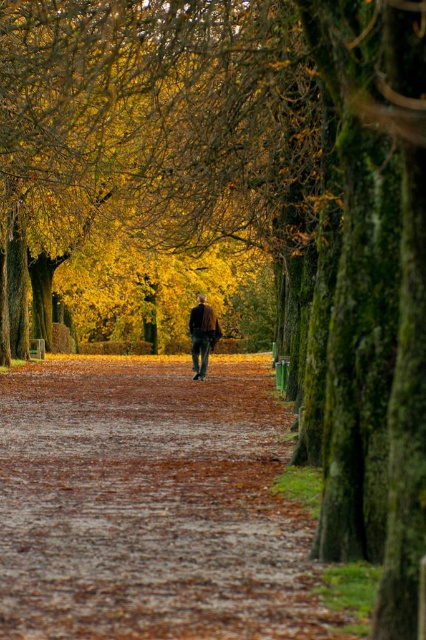
You are standing in the autumn park and see the brown leafy path at center and the dark brown leather jacket at center. Which object is located more to the left?

The brown leafy path at center is positioned on the left side of dark brown leather jacket at center, so it is more to the left.

You are standing at the starting point of the pathway in the autumn park scene. There are two points marked on the path ahead of you. The first point is at coordinates point (275, 422) and the second is at point (209, 340). Which of these two points is closer to your current position?

Point (275, 422) is closer to the camera than point (209, 340), so the first point is closer to your current position.

You are a hiker carrying a backpack and see the brown leafy path at center and the dark brown leather jacket at center. Which object is wider?

The brown leafy path at center is wider than the dark brown leather jacket at center according to the description.